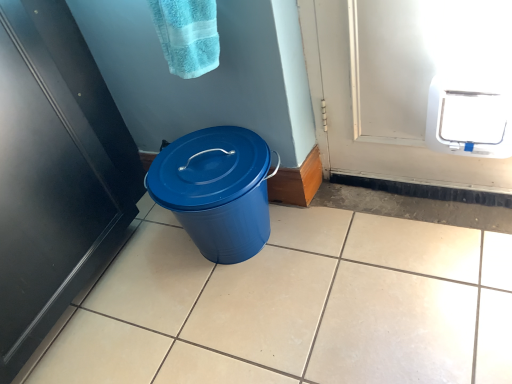
Question: Does white plastic pet door at upper right have a lesser height compared to black matte door at left?

Choices:
 (A) yes
 (B) no

Answer: (A)

Question: From a real-world perspective, is white plastic pet door at upper right located beneath black matte door at left?

Choices:
 (A) yes
 (B) no

Answer: (A)

Question: Is white plastic pet door at upper right taller than black matte door at left?

Choices:
 (A) yes
 (B) no

Answer: (B)

Question: Is white plastic pet door at upper right in contact with black matte door at left?

Choices:
 (A) no
 (B) yes

Answer: (A)

Question: Are white plastic pet door at upper right and black matte door at left far apart?

Choices:
 (A) no
 (B) yes

Answer: (B)

Question: In terms of height, does blue plastic trash can at center look taller or shorter compared to white plastic pet door at upper right?

Choices:
 (A) short
 (B) tall

Answer: (B)

Question: Considering the positions of blue plastic trash can at center and white plastic pet door at upper right in the image, is blue plastic trash can at center wider or thinner than white plastic pet door at upper right?

Choices:
 (A) thin
 (B) wide

Answer: (B)

Question: Relative to white plastic pet door at upper right, is blue plastic trash can at center in front or behind?

Choices:
 (A) front
 (B) behind

Answer: (B)

Question: Is blue plastic trash can at center spatially inside white plastic pet door at upper right, or outside of it?

Choices:
 (A) inside
 (B) outside

Answer: (B)

Question: Is point (32, 279) positioned closer to the camera than point (192, 38)?

Choices:
 (A) farther
 (B) closer

Answer: (A)

Question: From the image's perspective, relative to turquoise terry cloth towel at upper center, is black matte door at left above or below?

Choices:
 (A) below
 (B) above

Answer: (A)

Question: Based on their positions, is black matte door at left located to the left or right of turquoise terry cloth towel at upper center?

Choices:
 (A) left
 (B) right

Answer: (A)

Question: From a real-world perspective, is black matte door at left physically located above or below turquoise terry cloth towel at upper center?

Choices:
 (A) below
 (B) above

Answer: (A)

Question: In the image, is black matte door at left on the left side or the right side of white plastic pet door at upper right?

Choices:
 (A) right
 (B) left

Answer: (B)

Question: Considering the positions of point (8, 240) and point (475, 147), is point (8, 240) closer or farther from the camera than point (475, 147)?

Choices:
 (A) closer
 (B) farther

Answer: (A)